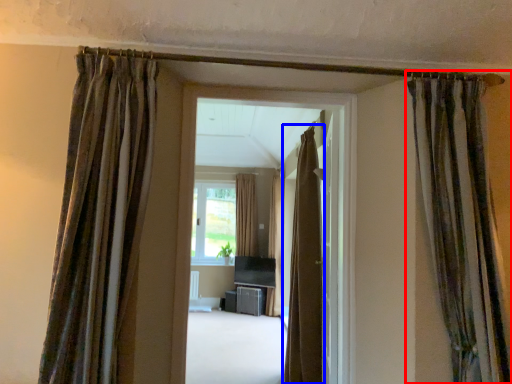
Question: Which object is further to the camera taking this photo, curtain (highlighted by a red box) or curtain (highlighted by a blue box)?

Choices:
 (A) curtain
 (B) curtain

Answer: (B)